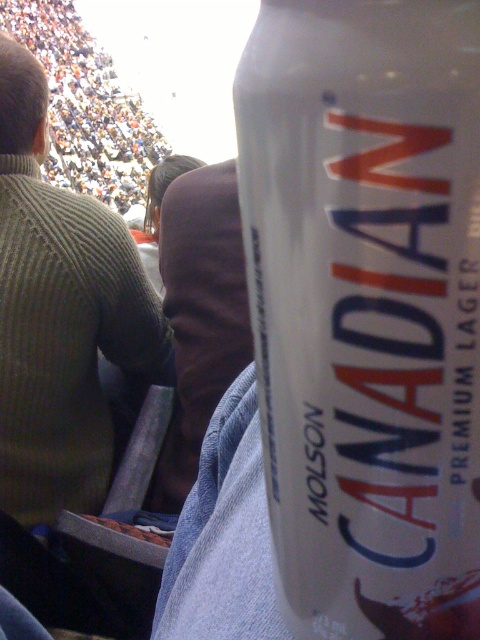
Question: Can you confirm if white matte can at center is positioned to the right of green ribbed sweater at upper left?

Choices:
 (A) yes
 (B) no

Answer: (A)

Question: Does white matte can at center come behind green ribbed sweater at upper left?

Choices:
 (A) yes
 (B) no

Answer: (B)

Question: Is white matte can at center further to camera compared to green ribbed sweater at upper left?

Choices:
 (A) yes
 (B) no

Answer: (B)